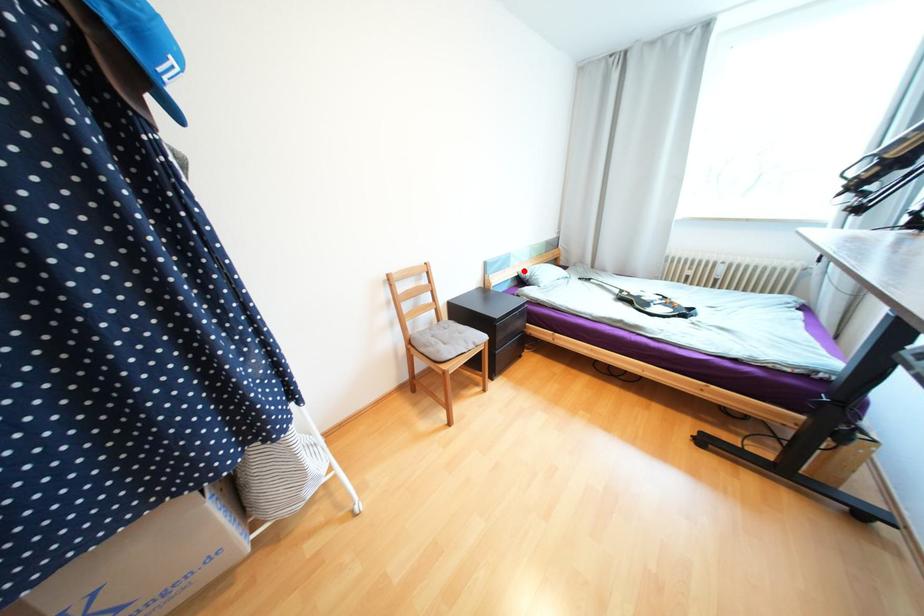
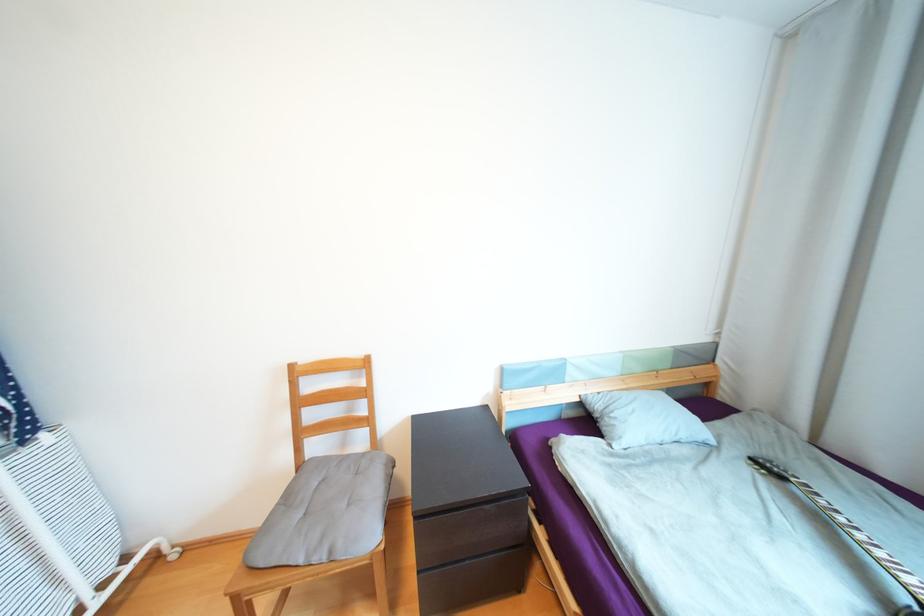
Where in the second image is the point corresponding to the highlighted location from the first image?

(588, 392)